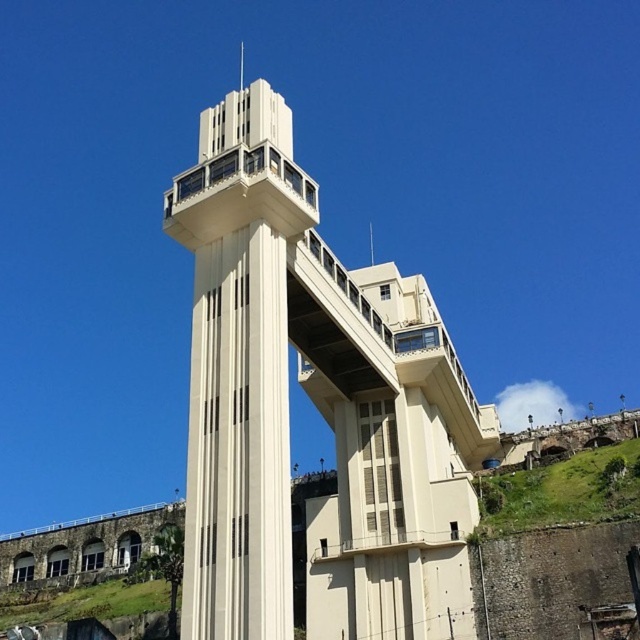
Image resolution: width=640 pixels, height=640 pixels. Describe the element at coordinates (316, 406) in the screenshot. I see `beige concrete tower at center` at that location.

Which is in front, point (227, 564) or point (305, 193)?

Positioned in front is point (227, 564).

Find the location of a particular element. The image size is (640, 640). beige concrete tower at center is located at coordinates (316, 406).